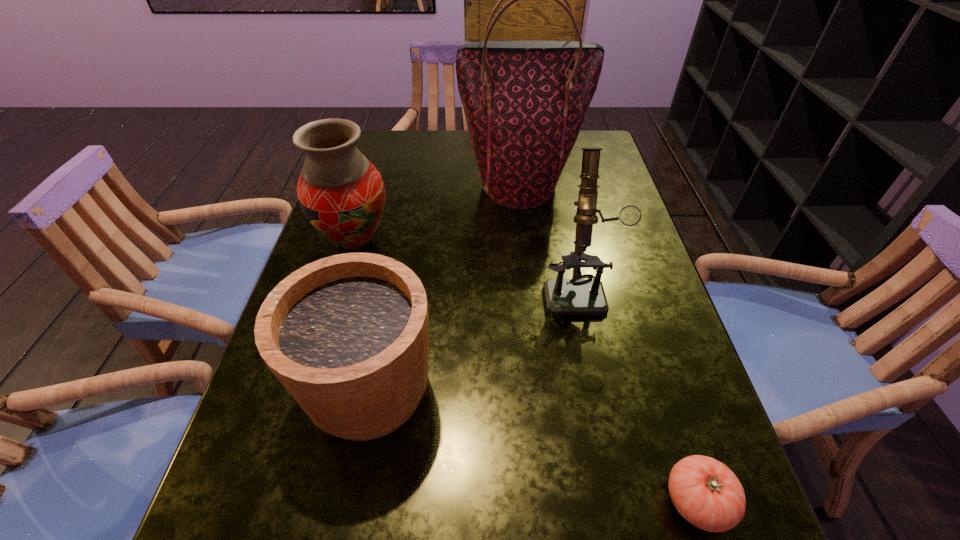
The width and height of the screenshot is (960, 540). I want to click on the farthest object, so click(x=524, y=101).

At what (x,y) coordinates should I click in order to perform the action: click on handbag. Please return your answer as a coordinate pair (x, y). Image resolution: width=960 pixels, height=540 pixels. Looking at the image, I should click on (524, 101).

Locate an element on the screen. The image size is (960, 540). microscope is located at coordinates (580, 295).

Locate an element on the screen. This screenshot has height=540, width=960. vase is located at coordinates (341, 193).

Identify the location of the fourth tallest object. The image size is (960, 540). (347, 335).

This screenshot has height=540, width=960. Identify the location of flowerpot. (347, 335).

Locate an element on the screen. The image size is (960, 540). the shortest object is located at coordinates (705, 492).

Locate an element on the screen. This screenshot has width=960, height=540. the nearest object is located at coordinates tap(705, 492).

Locate an element on the screen. This screenshot has width=960, height=540. blank space located on the right of the handbag is located at coordinates (609, 186).

The width and height of the screenshot is (960, 540). I want to click on vacant area situated 0.170m at the eyepiece of the microscope, so click(600, 390).